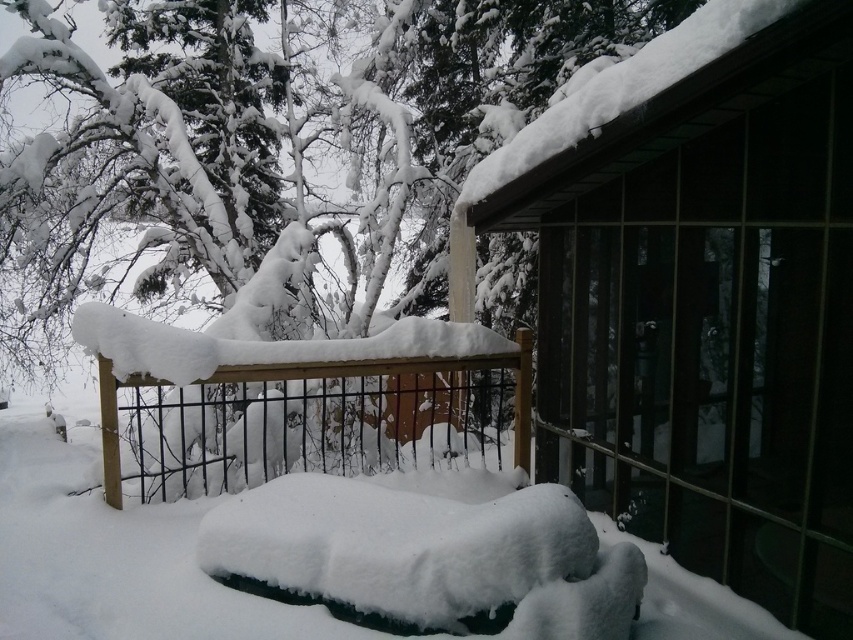
You are a guest at a winter retreat and want to take a photo of the wooden cabin at upper right and the wooden fence at center from a position where both are visible. Considering their heights, which object will appear larger in the photo?

The wooden cabin at upper right will appear larger in the photo because it is much taller than the wooden fence at center.

Consider the image. You are planning to build a new shed in your backyard. You want to place it in the same relative position as the wooden cabin at upper right and the wooden fence at center in the image. Which object should be placed higher up from the ground level?

The wooden cabin at upper right should be placed higher up from the ground level than the wooden fence at center because the wooden cabin at upper right is located above the wooden fence at center in the image.

You are planning to build a new garden shed and want to ensure it fits within the available space. You see the wooden cabin at upper right and the wooden fence at center in the scene. Which structure has a smaller width?

The wooden cabin at upper right has a smaller width than the wooden fence at center.